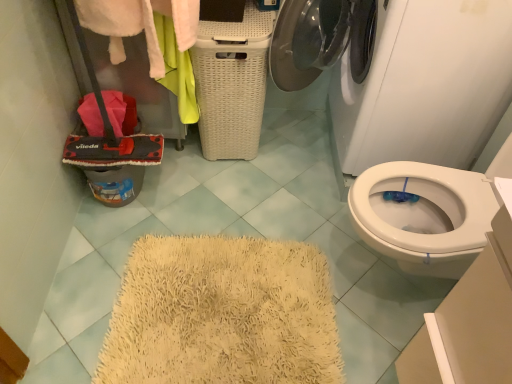
In order to click on white fluffy towel at upper left in this screenshot , I will do `click(152, 39)`.

This screenshot has height=384, width=512. Identify the location of white wicker basket at center. (230, 100).

Consider the image. Which of these two, white wicker basket at center or white glossy washing machine at upper center, is wider?

With larger width is white glossy washing machine at upper center.

From a real-world perspective, is white wicker basket at center located higher than white glossy washing machine at upper center?

Incorrect, from a real-world perspective, white wicker basket at center is lower than white glossy washing machine at upper center.

Is white wicker basket at center positioned far away from white glossy washing machine at upper center?

Actually, white wicker basket at center and white glossy washing machine at upper center are a little close together.

In terms of size, does white wicker basket at center appear bigger or smaller than white fluffy towel at upper left?

In the image, white wicker basket at center appears to be smaller than white fluffy towel at upper left.

Is white fluffy towel at upper left inside white wicker basket at center?

Actually, white fluffy towel at upper left is outside white wicker basket at center.

Is white wicker basket at center taller than white fluffy towel at upper left?

No.

From the image's perspective, which is below, white wicker basket at center or white fluffy towel at upper left?

white wicker basket at center is shown below in the image.

In the scene shown: Which object is positioned more to the left, white fluffy towel at upper left or white glossy washing machine at upper center?

white fluffy towel at upper left.

Does white fluffy towel at upper left come in front of white glossy washing machine at upper center?

No, the depth of white fluffy towel at upper left is greater than that of white glossy washing machine at upper center.

Considering the relative sizes of white fluffy towel at upper left and white glossy washing machine at upper center in the image provided, is white fluffy towel at upper left smaller than white glossy washing machine at upper center?

Yes, white fluffy towel at upper left is smaller than white glossy washing machine at upper center.

Does white fluffy towel at upper left have a lesser width compared to white glossy washing machine at upper center?

Yes.

Locate an element on the screen. The image size is (512, 384). clothing above the white wicker basket at center (from the image's perspective) is located at coordinates (152, 39).

Is white fluffy towel at upper left in front of or behind white wicker basket at center in the image?

In the image, white fluffy towel at upper left appears in front of white wicker basket at center.

Is white fluffy towel at upper left smaller than white wicker basket at center?

No.

Is white fluffy towel at upper left thinner than white wicker basket at center?

Indeed, white fluffy towel at upper left has a lesser width compared to white wicker basket at center.

Would you say white glossy washing machine at upper center is outside white wicker basket at center?

Yes, white glossy washing machine at upper center is outside of white wicker basket at center.

Measure the distance from white glossy washing machine at upper center to white wicker basket at center.

The distance of white glossy washing machine at upper center from white wicker basket at center is 21.25 inches.

Is white glossy washing machine at upper center bigger than white wicker basket at center?

Indeed, white glossy washing machine at upper center has a larger size compared to white wicker basket at center.

From a real-world perspective, does white glossy washing machine at upper center sit lower than white wicker basket at center?

No, from a real-world perspective, white glossy washing machine at upper center is not under white wicker basket at center.

Is white glossy washing machine at upper center oriented away from white fluffy towel at upper left?

white glossy washing machine at upper center is not turned away from white fluffy towel at upper left.

Find the location of a particular element. clothing above the white glossy washing machine at upper center (from the image's perspective) is located at coordinates (152, 39).

Considering the positions of objects white glossy washing machine at upper center and white fluffy towel at upper left in the image provided, who is more to the left, white glossy washing machine at upper center or white fluffy towel at upper left?

From the viewer's perspective, white fluffy towel at upper left appears more on the left side.

Is white glossy washing machine at upper center inside the boundaries of white fluffy towel at upper left, or outside?

white glossy washing machine at upper center exists outside the volume of white fluffy towel at upper left.

The height and width of the screenshot is (384, 512). What are the coordinates of `basket that appears behind the white glossy washing machine at upper center` in the screenshot? It's located at (230, 100).

This screenshot has height=384, width=512. What are the coordinates of `basket below the white fluffy towel at upper left (from a real-world perspective)` in the screenshot? It's located at (230, 100).

When comparing their distances from white wicker basket at center, does white glossy washing machine at upper center or white fluffy towel at upper left seem closer?

The object closer to white wicker basket at center is white fluffy towel at upper left.

Looking at the image, which one is located further to white glossy washing machine at upper center, white fluffy towel at upper left or white wicker basket at center?

white fluffy towel at upper left.

From the image, which object appears to be nearer to white fluffy towel at upper left, white wicker basket at center or white glossy washing machine at upper center?

The object closer to white fluffy towel at upper left is white wicker basket at center.

Looking at the image, which one is located closer to white fluffy towel at upper left, white glossy washing machine at upper center or white wicker basket at center?

Based on the image, white wicker basket at center appears to be nearer to white fluffy towel at upper left.

When comparing their distances from white wicker basket at center, does white fluffy towel at upper left or white glossy washing machine at upper center seem further?

Among the two, white glossy washing machine at upper center is located further to white wicker basket at center.

Estimate the real-world distances between objects in this image. Which object is further from white glossy washing machine at upper center, white wicker basket at center or white fluffy towel at upper left?

→ white fluffy towel at upper left lies further to white glossy washing machine at upper center than the other object.

Identify the location of basket between white fluffy towel at upper left and white glossy washing machine at upper center from left to right. This screenshot has height=384, width=512. (230, 100).